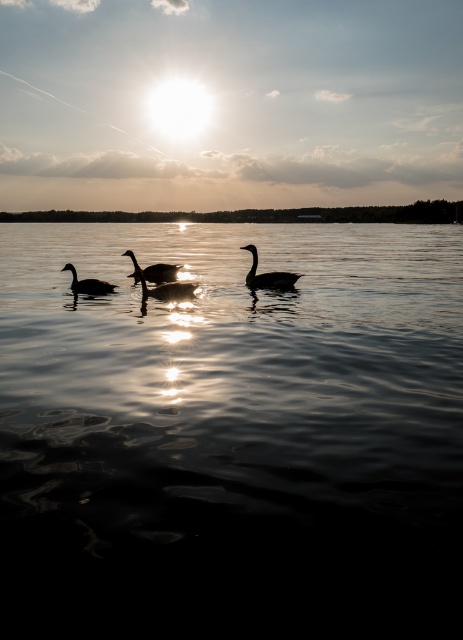
Question: Which object is the closest to the black matte goose at center?

Choices:
 (A) matte black duck at center
 (B) transparent water at center
 (C) silvery glossy goose at center
 (D) matte black goose at left

Answer: (A)

Question: Which point is farther from the camera taking this photo?

Choices:
 (A) (72, 396)
 (B) (158, 269)
 (C) (255, 284)

Answer: (B)

Question: Among these objects, which one is farthest from the camera?

Choices:
 (A) matte black duck at center
 (B) transparent water at center
 (C) silvery glossy goose at center

Answer: (C)

Question: Does silvery glossy goose at center have a lesser width compared to matte black goose at left?

Choices:
 (A) no
 (B) yes

Answer: (B)

Question: Can you confirm if transparent water at center is positioned to the right of matte black duck at center?

Choices:
 (A) yes
 (B) no

Answer: (A)

Question: Observing the image, what is the correct spatial positioning of transparent water at center in reference to silvery glossy goose at center?

Choices:
 (A) left
 (B) right

Answer: (B)